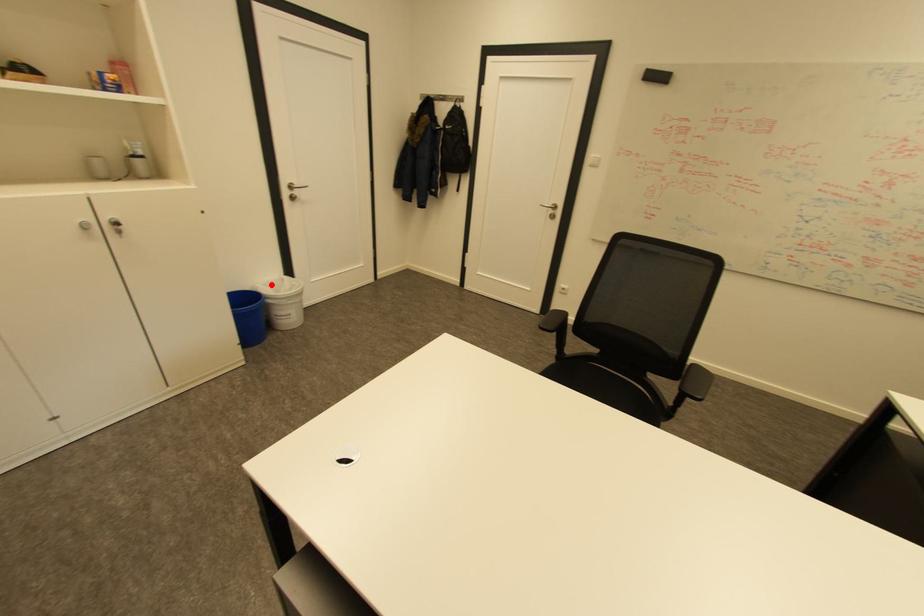
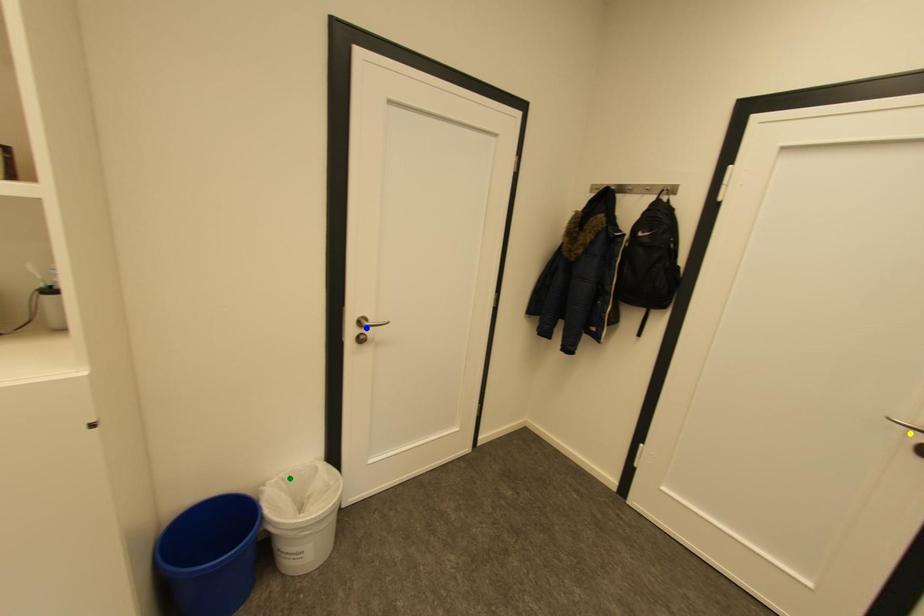
Question: I am providing you with two images of the same scene from different viewpoints. A red point is marked on the first image. You are given multiple points on the second image. Which point in image 2 is actually the same real-world point as the red point in image 1?

Choices:
 (A) green point
 (B) blue point
 (C) yellow point

Answer: (A)